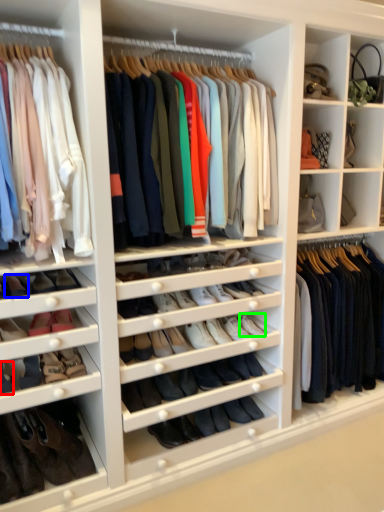
Question: Which is farther away from shoe (highlighted by a red box)? shoe (highlighted by a blue box) or shoe (highlighted by a green box)?

Choices:
 (A) shoe
 (B) shoe

Answer: (B)